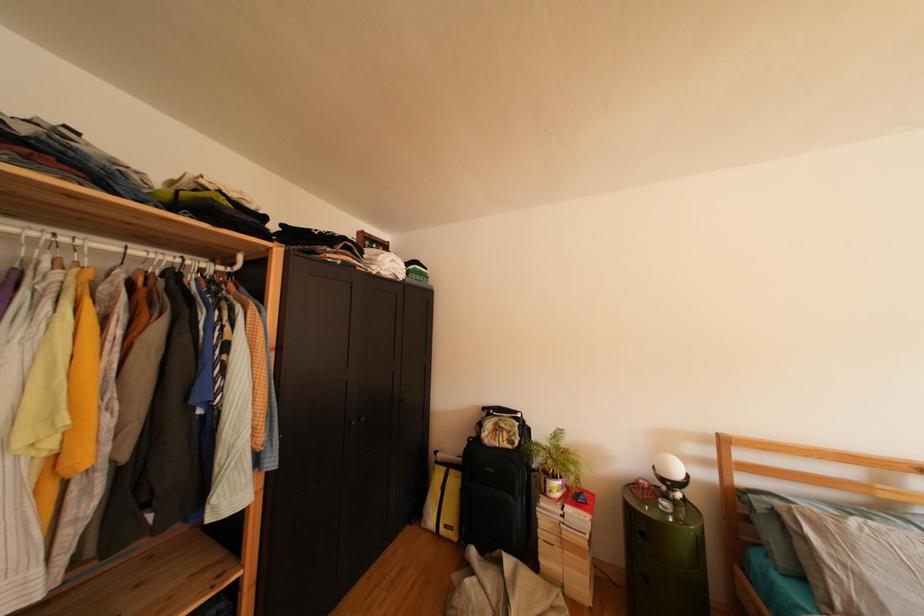
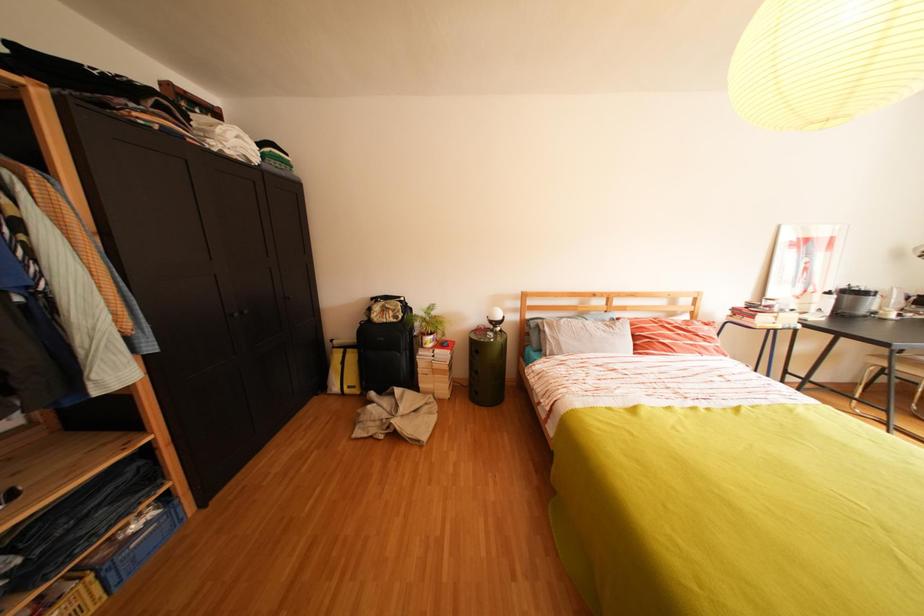
First-person continuous shooting, in which direction is the camera rotating?

The camera's rotation is toward right-down.